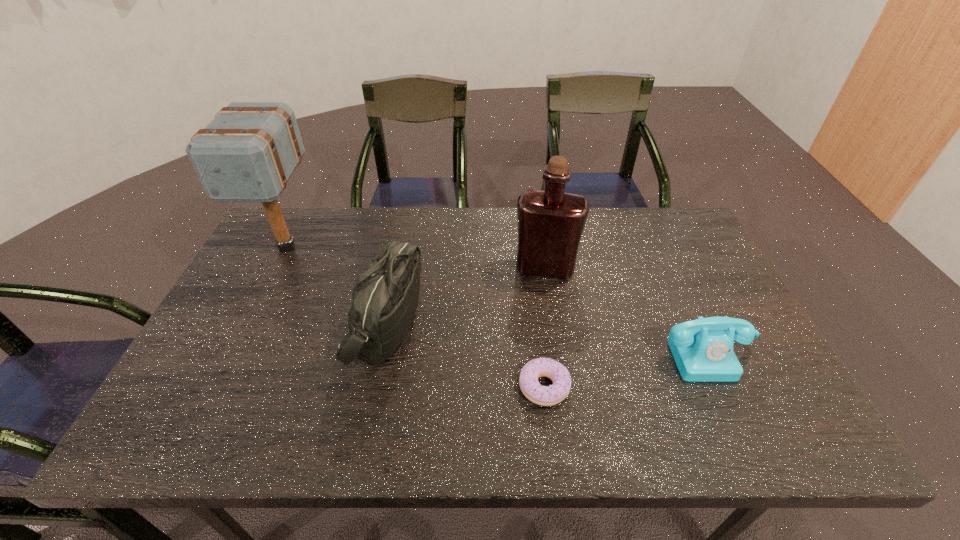
The height and width of the screenshot is (540, 960). Find the location of `vacant space at the right edge of the desktop`. vacant space at the right edge of the desktop is located at coordinates (684, 311).

You are a GUI agent. You are given a task and a screenshot of the screen. Output one action in this format:
    pyautogui.click(x=<x>, y=<y>)
    Task: Click on the blank region between the telephone and the second tallest object
    The width and height of the screenshot is (960, 540).
    Given the screenshot: What is the action you would take?
    coord(626,310)

You are a GUI agent. You are given a task and a screenshot of the screen. Output one action in this format:
    pyautogui.click(x=<x>, y=<y>)
    Task: Click on the vacant area that lies between the shortest object and the second tallest object
    The width and height of the screenshot is (960, 540).
    Given the screenshot: What is the action you would take?
    pyautogui.click(x=544, y=327)

I want to click on free spot between the fourth shortest object and the doughnut, so click(x=544, y=327).

The width and height of the screenshot is (960, 540). Find the location of `vacant space that is in between the doughnut and the second tallest object`. vacant space that is in between the doughnut and the second tallest object is located at coordinates (544, 327).

I want to click on vacant region between the mallet and the fourth tallest object, so click(x=497, y=300).

The height and width of the screenshot is (540, 960). In order to click on free space that is in between the rightmost object and the shortest object in this screenshot , I will do `click(626, 370)`.

This screenshot has width=960, height=540. Identify the location of free space that is in between the fourth object from right to left and the shortest object. (465, 355).

The height and width of the screenshot is (540, 960). Find the location of `vacant region between the fourth object from right to left and the leftmost object`. vacant region between the fourth object from right to left and the leftmost object is located at coordinates (336, 286).

Where is `free point between the shoulder bag and the shortest object`? This screenshot has height=540, width=960. free point between the shoulder bag and the shortest object is located at coordinates (465, 355).